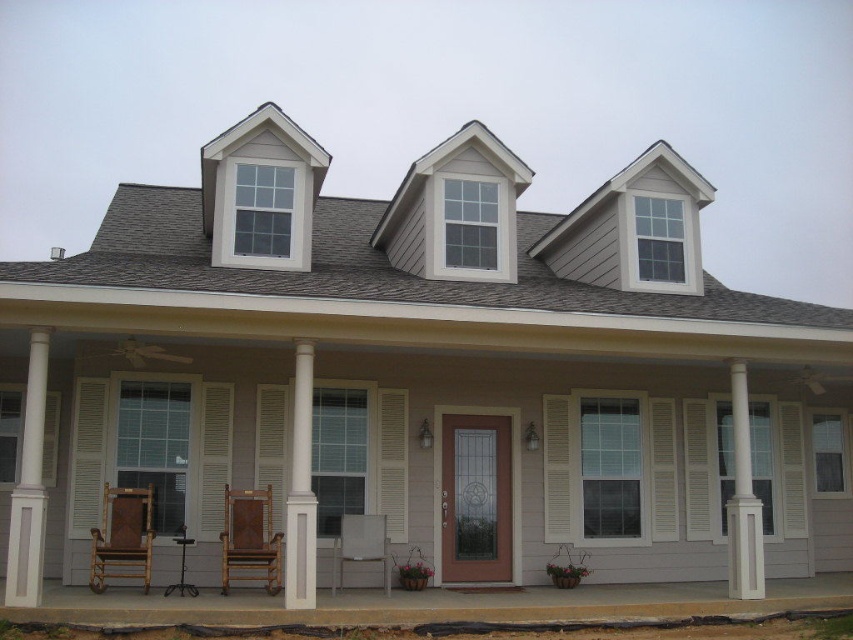
You are standing on the front porch of the house and want to hang a wreath on the front door. To do this, you need to move past the white louvered shutter at center and the white painted wood column at right. Which object should you move around first as you approach the door?

You should move around the white louvered shutter at center first because it is positioned to the left of the white painted wood column at right, meaning it is closer to the door when approaching from the porch.

You are standing on the front porch of the house and want to place the light brown wooden chair at center in front of the white louvered shutter at center. Is there enough space for the chair to fit without overlapping the shutter?

The white louvered shutter at center might be wider than the light brown wooden chair at center, so there might be enough space for the chair to fit without overlapping the shutter, but it depends on the exact dimensions.

You are standing on the front porch of the house and want to know if you can hang a small rectangular sign above the white louvered shutter at center without it touching the white painted wood column at right. Can you do this?

The white louvered shutter at center is not as tall as the white painted wood column at right, so the sign can be hung above the shutter without touching the column.